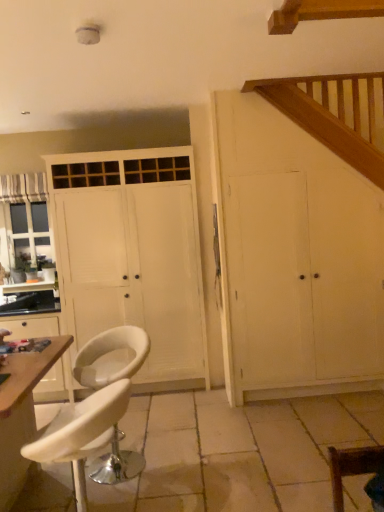
What are the coordinates of `free spot to the right of white leather bar stool at lower left, which appears as the first chair when viewed from the left` in the screenshot? It's located at (188, 460).